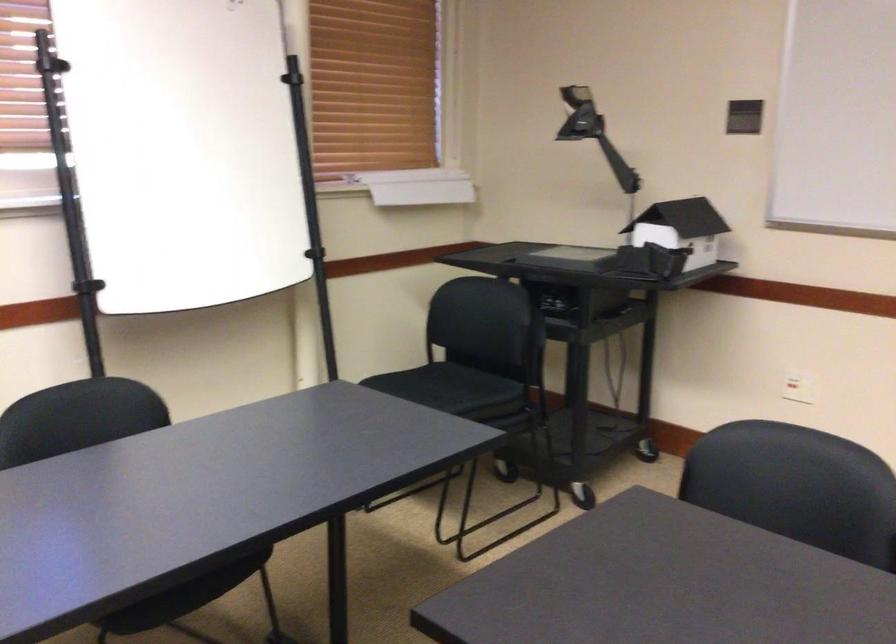
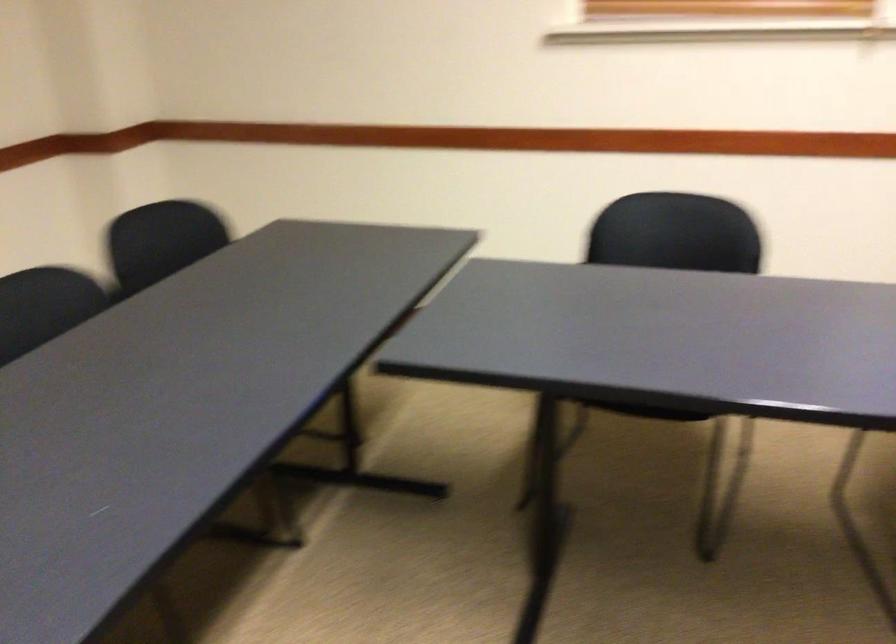
How did the camera likely rotate?

The camera's rotation is toward left-down.